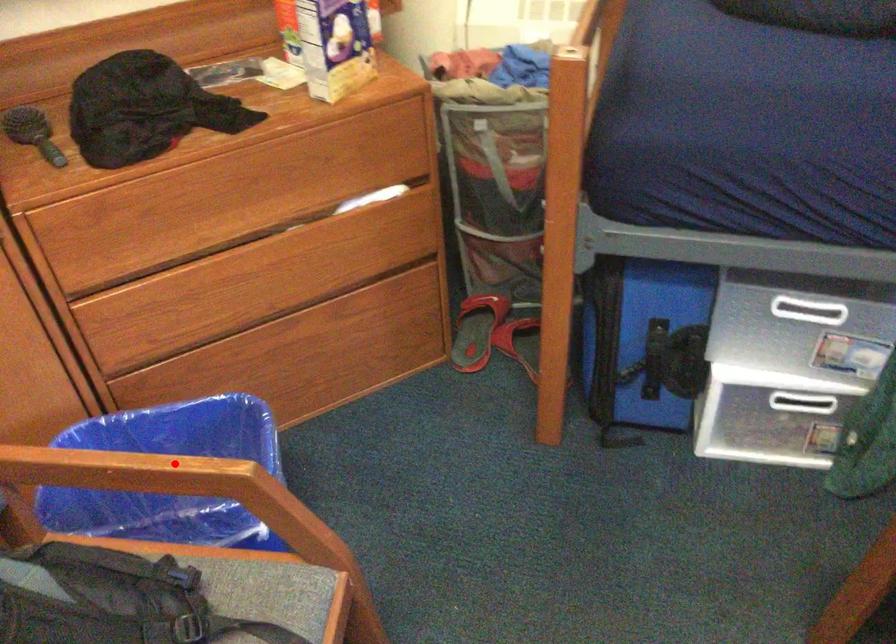
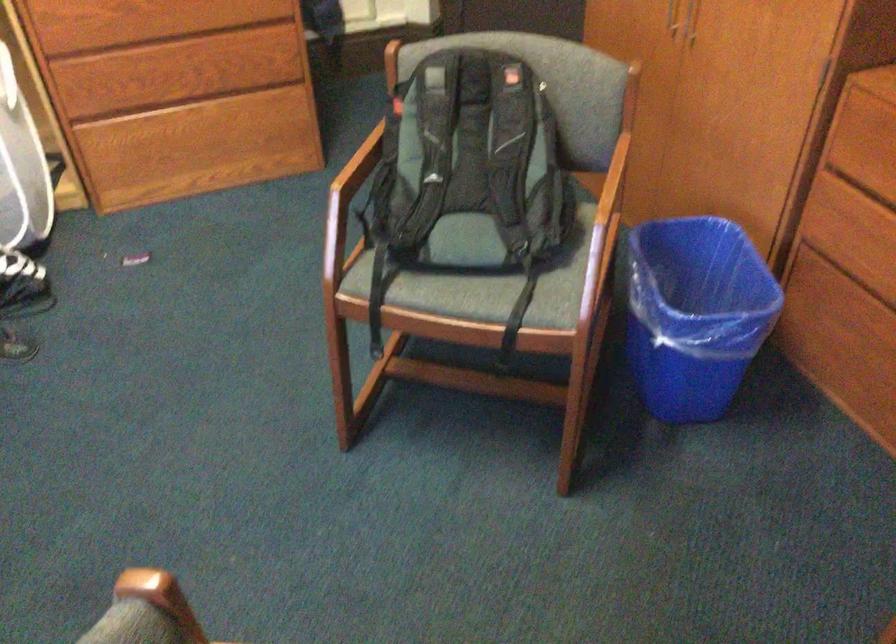
Find the pixel in the second image that matches the highlighted location in the first image.

(609, 201)